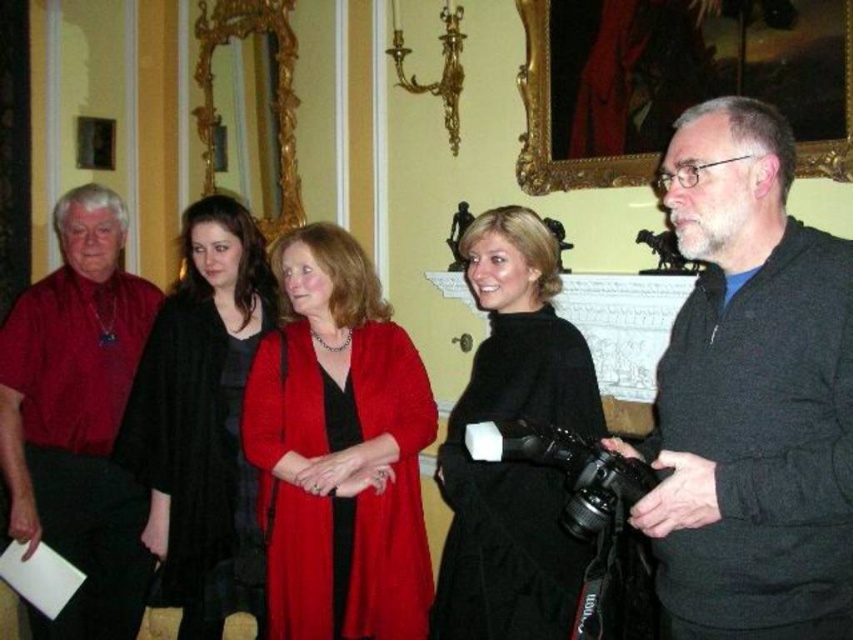
Between dark gray sweater at right and black rubberized video camera at center, which one is positioned higher?

Positioned higher is dark gray sweater at right.

Is dark gray sweater at right above black rubberized video camera at center?

Indeed, dark gray sweater at right is positioned over black rubberized video camera at center.

Is point (772, 467) in front of point (532, 460)?

That is True.

At what (x,y) coordinates should I click in order to perform the action: click on dark gray sweater at right. Please return your answer as a coordinate pair (x, y). The image size is (853, 640). Looking at the image, I should click on (751, 394).

Can you confirm if matte red coat at center is taller than matte red shirt at left?

In fact, matte red coat at center may be shorter than matte red shirt at left.

Who is more distant from viewer, (347, 250) or (9, 381)?

The point (9, 381) is more distant.

This screenshot has width=853, height=640. What do you see at coordinates (339, 449) in the screenshot?
I see `matte red coat at center` at bounding box center [339, 449].

Where is `matte red coat at center`? The width and height of the screenshot is (853, 640). matte red coat at center is located at coordinates [x=339, y=449].

Does point (410, 387) come closer to viewer compared to point (202, 342)?

Yes, it is in front of point (202, 342).

You are a GUI agent. You are given a task and a screenshot of the screen. Output one action in this format:
    pyautogui.click(x=<x>, y=<y>)
    Task: Click on the matte red coat at center
    
    Given the screenshot: What is the action you would take?
    pyautogui.click(x=339, y=449)